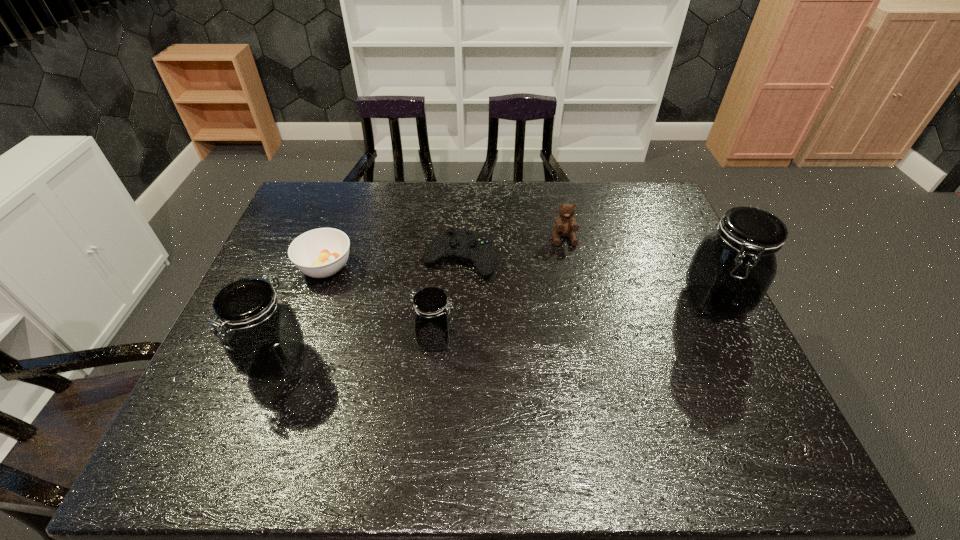
I want to click on vacant point located 0.360m on the lid of the second jar from right to left, so (x=599, y=339).

You are a GUI agent. You are given a task and a screenshot of the screen. Output one action in this format:
    pyautogui.click(x=<x>, y=<y>)
    Task: Click on the vacant region located 0.070m on the front of the second shortest object
    
    Given the screenshot: What is the action you would take?
    pyautogui.click(x=312, y=307)

At what (x,y) coordinates should I click in order to perform the action: click on vacant region located 0.160m on the back of the control. Please return your answer as a coordinate pair (x, y). Looking at the image, I should click on (462, 207).

Where is `free location located 0.110m on the face of the fifth object from left to right`? The height and width of the screenshot is (540, 960). free location located 0.110m on the face of the fifth object from left to right is located at coordinates (570, 272).

Image resolution: width=960 pixels, height=540 pixels. I want to click on object that is at the near edge, so click(x=261, y=334).

You are a GUI agent. You are given a task and a screenshot of the screen. Output one action in this format:
    pyautogui.click(x=<x>, y=<y>)
    Task: Click on the jar positioned at the left edge
    
    Given the screenshot: What is the action you would take?
    pyautogui.click(x=261, y=334)

Identify the location of soup bowl positioned at the left edge. (323, 252).

Identify the location of object that is at the right edge. (733, 267).

The width and height of the screenshot is (960, 540). Identify the location of object located in the near left corner section of the desktop. (261, 334).

Locate an element on the screen. Image resolution: width=960 pixels, height=540 pixels. vacant space at the far edge is located at coordinates (472, 181).